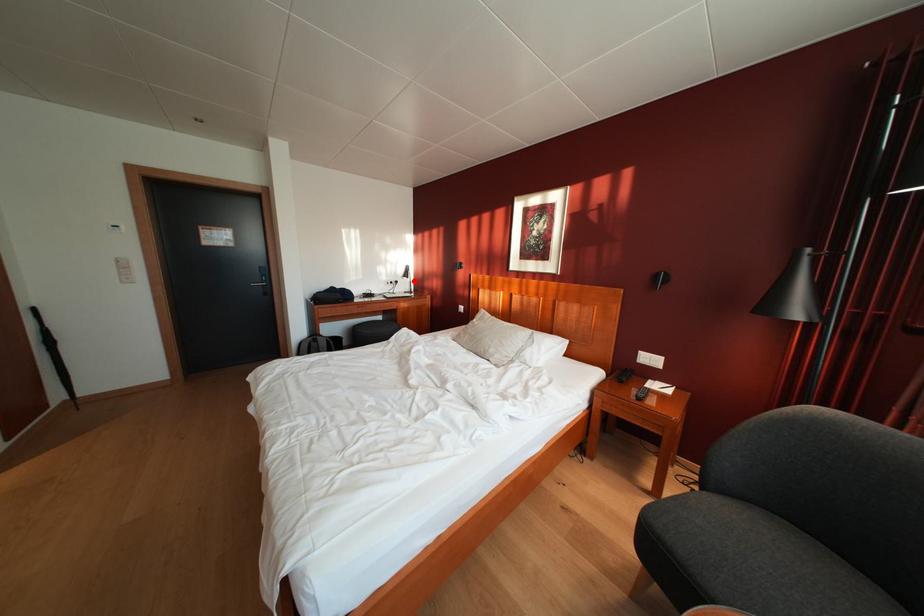
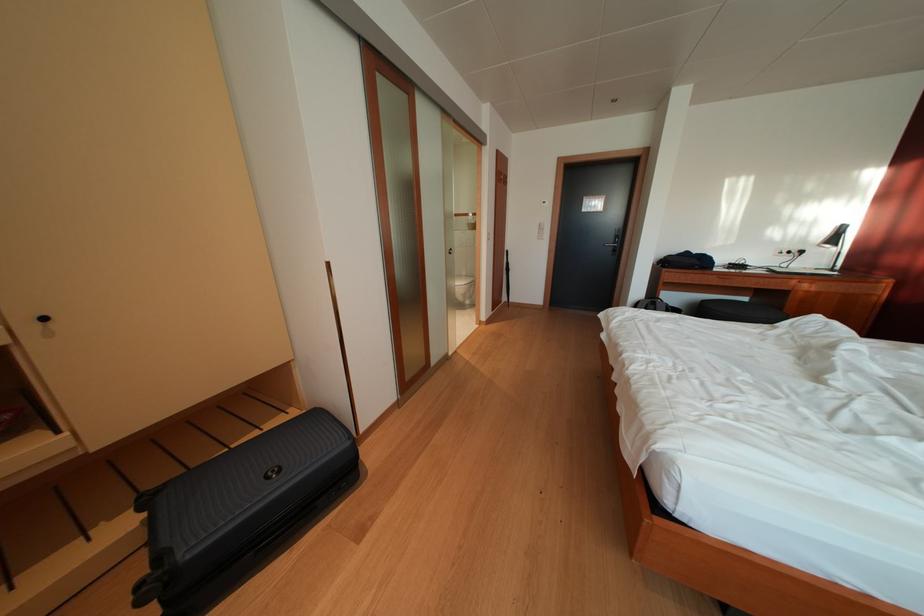
Locate, in the second image, the point that corresponds to the highlighted location in the first image.

(842, 246)